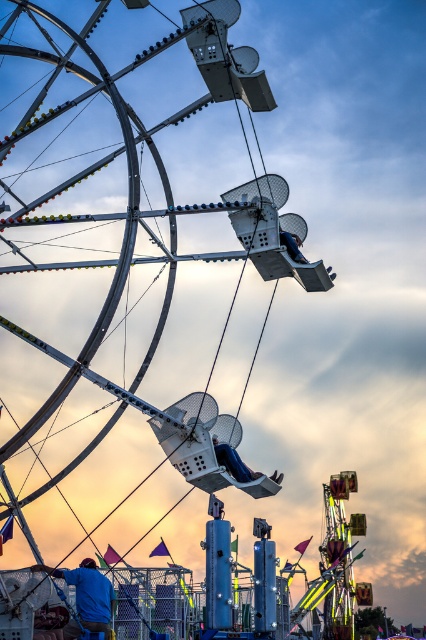
Between metallic silver ferris wheel at center and blue fabric seat at upper center, which one has more height?

With more height is metallic silver ferris wheel at center.

Is metallic silver ferris wheel at center shorter than blue fabric seat at upper center?

In fact, metallic silver ferris wheel at center may be taller than blue fabric seat at upper center.

Looking at this image, who is more forward, (296, 236) or (299, 240)?

Positioned in front is point (299, 240).

Identify the location of metallic silver ferris wheel at center. (293, 225).

Is point (69, 636) behind point (299, 237)?

Yes, point (69, 636) is behind point (299, 237).

Measure the distance between blue fabric at lower left and camera.

A distance of 343.52 feet exists between blue fabric at lower left and camera.

Find the location of a particular element. blue fabric at lower left is located at coordinates (88, 593).

From the picture: Between blue fabric seat at center and metallic silver ferris wheel at center, which one appears on the left side from the viewer's perspective?

blue fabric seat at center

Can you confirm if blue fabric seat at center is positioned above metallic silver ferris wheel at center?

Incorrect, blue fabric seat at center is not positioned above metallic silver ferris wheel at center.

Does point (233, 468) come behind point (287, 218)?

No, it is in front of (287, 218).

This screenshot has width=426, height=640. What are the coordinates of `blue fabric seat at center` in the screenshot? It's located at (233, 461).